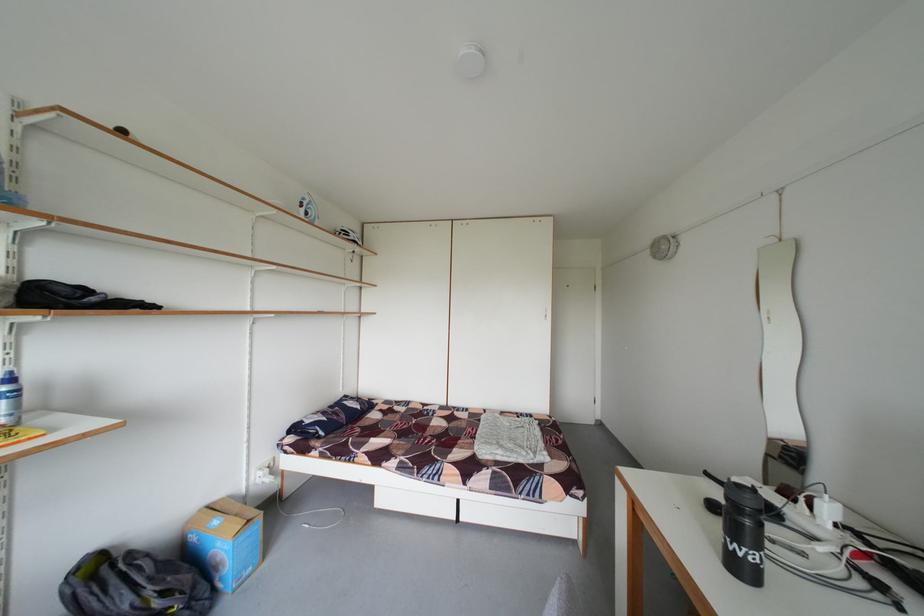
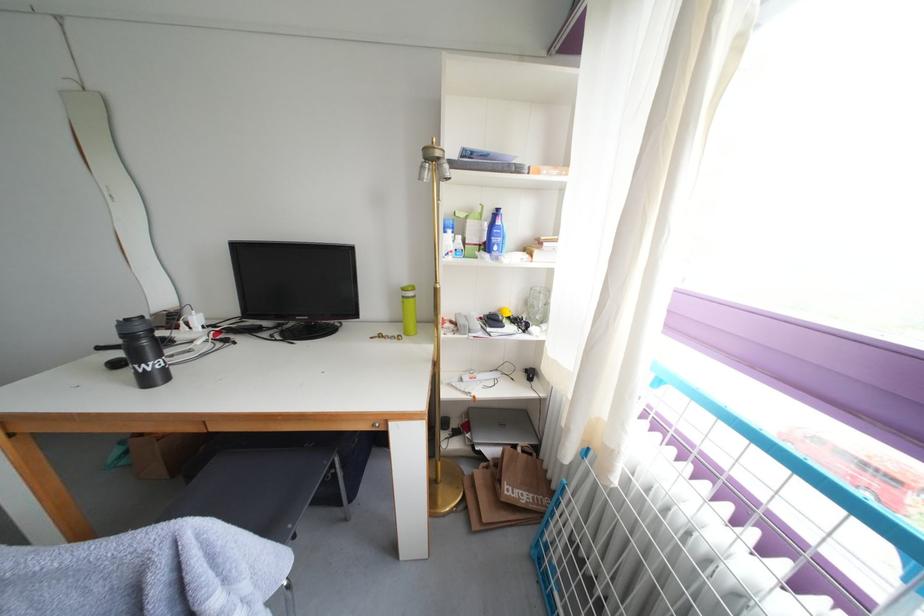
Locate, in the second image, the point that corresponds to (759,507) in the first image.

(150, 334)